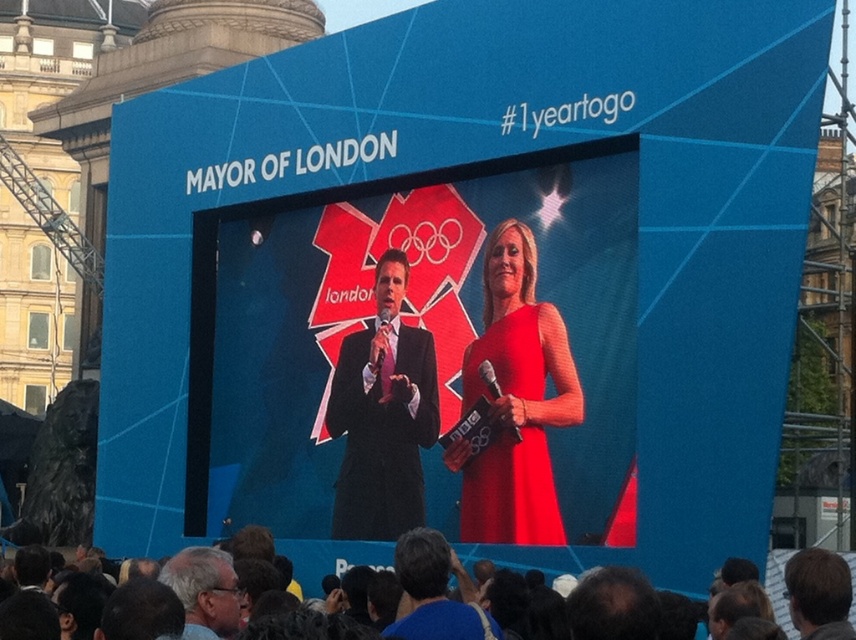
Can you confirm if dark blue fabric at lower center is wider than smooth brown hair at center?

Yes, dark blue fabric at lower center is wider than smooth brown hair at center.

Between dark blue fabric at lower center and smooth brown hair at center, which one is positioned lower?

dark blue fabric at lower center

Measure the distance between dark blue fabric at lower center and camera.

A distance of 35.46 meters exists between dark blue fabric at lower center and camera.

You are a GUI agent. You are given a task and a screenshot of the screen. Output one action in this format:
    pyautogui.click(x=<x>, y=<y>)
    Task: Click on the dark blue fabric at lower center
    The image size is (856, 640).
    Given the screenshot: What is the action you would take?
    pyautogui.click(x=544, y=557)

Is matte red dress at center wider than matte black suit at center?

Indeed, matte red dress at center has a greater width compared to matte black suit at center.

Can you confirm if matte red dress at center is positioned below matte black suit at center?

Correct, matte red dress at center is located below matte black suit at center.

Between point (519, 289) and point (355, 362), which one is positioned behind?

The point (355, 362) is more distant.

This screenshot has width=856, height=640. In order to click on matte red dress at center in this screenshot , I will do `click(515, 401)`.

How much distance is there between smooth glossy screen at center and dark blue fabric at lower center?

The distance of smooth glossy screen at center from dark blue fabric at lower center is 6.02 meters.

Between point (538, 244) and point (768, 580), which one is positioned in front?

Point (768, 580)

Is point (254, 336) positioned behind point (676, 589)?

Yes, it is behind point (676, 589).

Locate an element on the screen. The image size is (856, 640). smooth glossy screen at center is located at coordinates (434, 358).